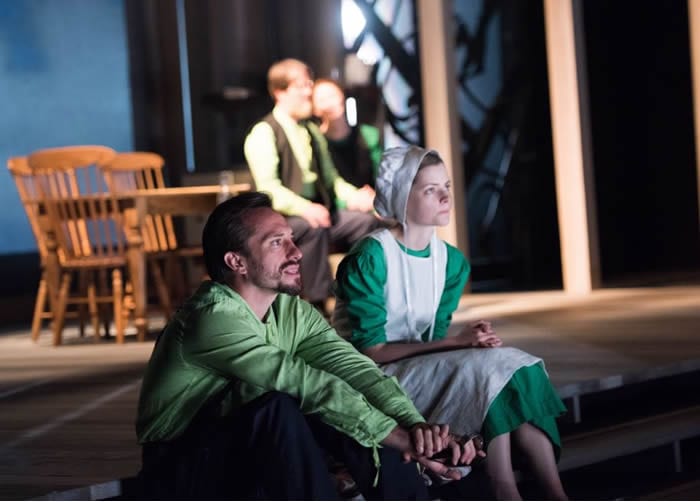
The width and height of the screenshot is (700, 502). Find the location of `wooden chair`. wooden chair is located at coordinates (71, 156), (130, 157), (20, 168).